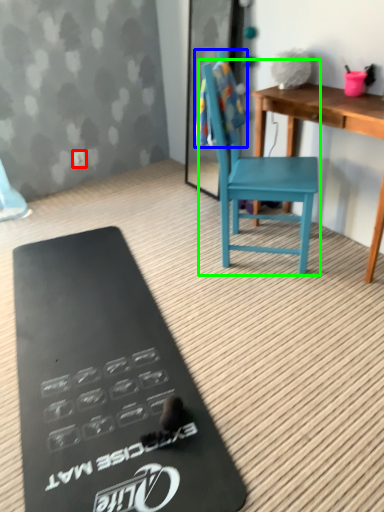
Question: Estimate the real-world distances between objects in this image. Which object is farther from power outlet (highlighted by a red box), towel/napkin (highlighted by a blue box) or armchair (highlighted by a green box)?

Choices:
 (A) towel/napkin
 (B) armchair

Answer: (B)